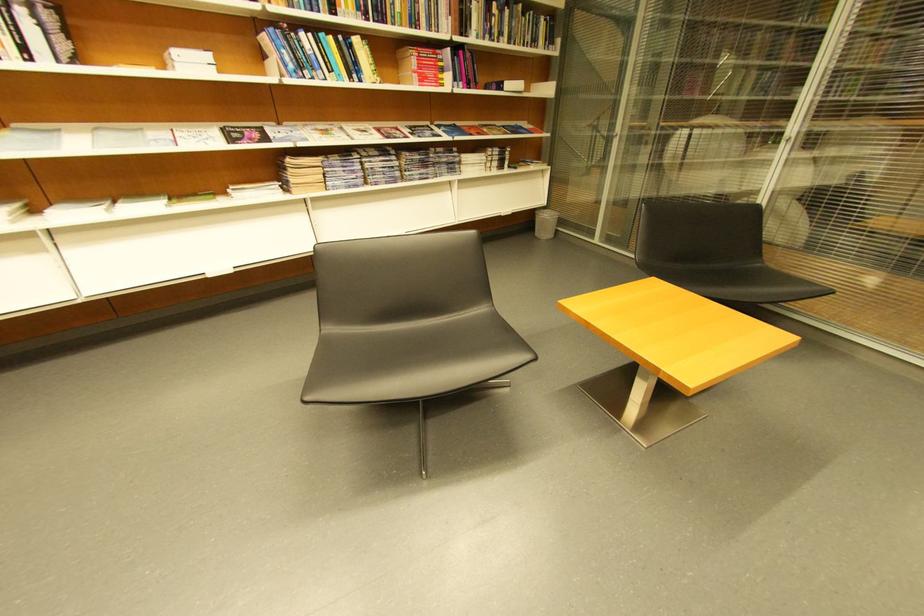
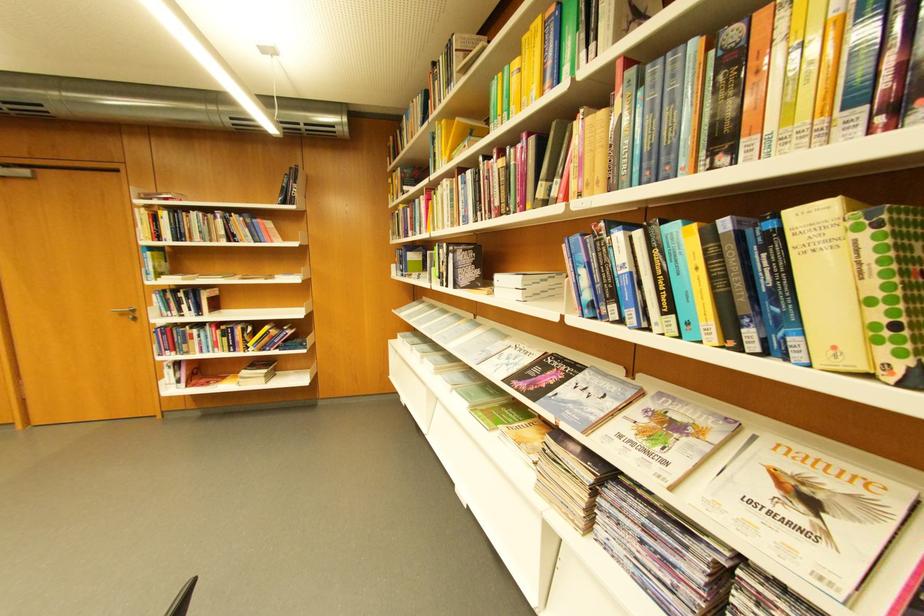
Find the pixel in the second image that matches pixel 362 39 in the first image.

(796, 214)